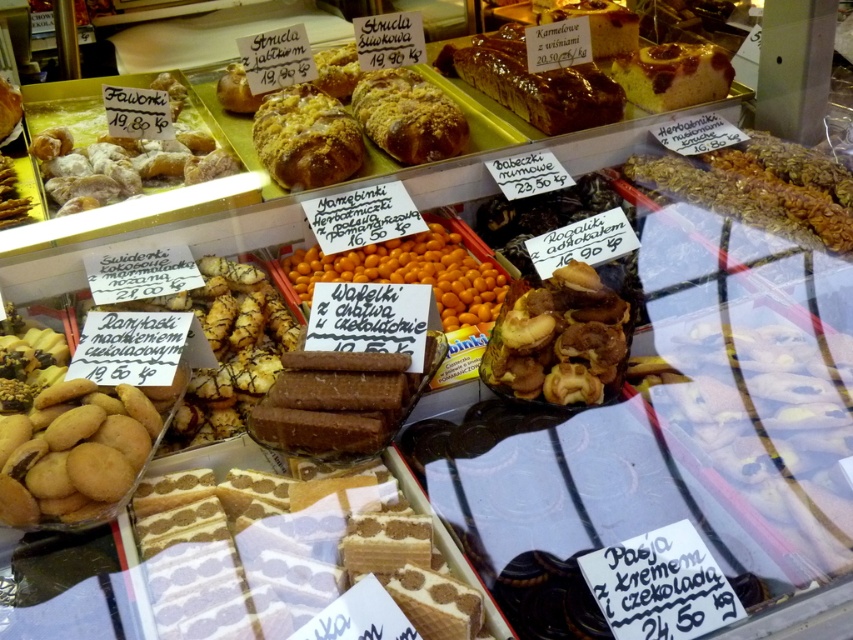
You are a customer at the bakery counter. You want to buy both the white creamy cake at center and the golden crumbly bun at upper center. The cashier is located behind the counter, 40 inches away from you. Can you reach both items without moving from your current position?

The white creamy cake at center is 37.59 inches away from the golden crumbly bun at upper center. Since both items are within the 40 inches distance to the cashier, you can reach both items without moving from your current position.

You are a customer at the bakery counter. You want to know where the granular textured nuts at upper right are located. Can you tell me their exact position on the counter?

The granular textured nuts at upper right are located at point [761,188] on the counter.

You are a customer at a bakery counter and see the white creamy cake at center and the golden crumbly bun at upper center. Which item is located to the right of the other?

The white creamy cake at center is positioned on the right side of golden crumbly bun at upper center.